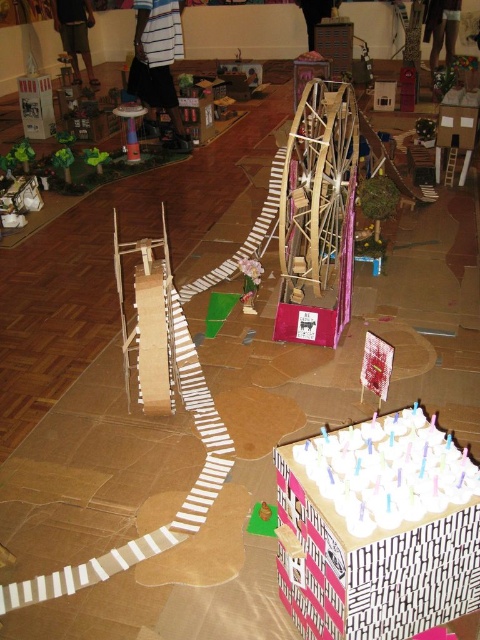
What object is located at the coordinates point (158, 61) in the cardboard diorama?

The striped fabric shirt at upper center is located at point (158, 61).

You are a visitor looking at the cardboard diorama. You notice the striped fabric shirt at upper center and the metallic silver tower at center. Which object is closer to you?

The striped fabric shirt at upper center is closer to you because it is in front of the metallic silver tower at center.

You are setting up a display for a school project and want to place the white striped cake at lower right next to the striped fabric shirt at upper center. Which object has a smaller width?

The white striped cake at lower right has a smaller width than the striped fabric shirt at upper center.